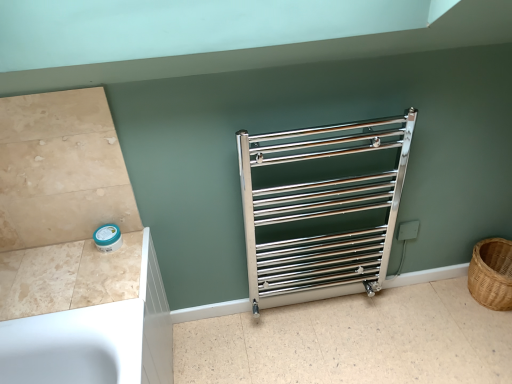
The width and height of the screenshot is (512, 384). In order to click on vacant space situated above metallic silver towel rack at center (from a real-world perspective) in this screenshot , I will do click(359, 338).